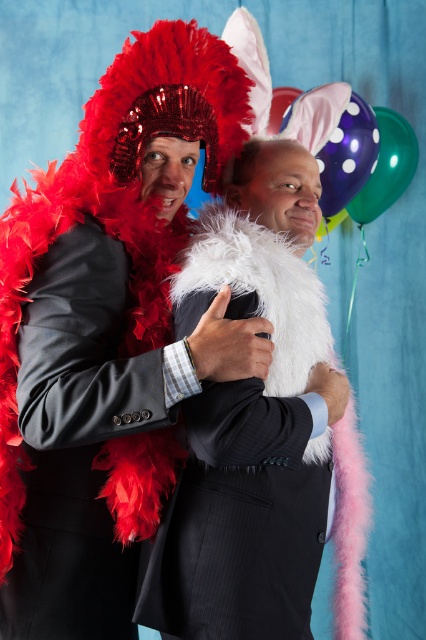
Based on the photo, which is more to the left, white fluffy boa at center or shiny purple balloon at upper right?

Positioned to the left is white fluffy boa at center.

Does white fluffy boa at center come behind shiny purple balloon at upper right?

No, white fluffy boa at center is closer to the viewer.

This screenshot has width=426, height=640. In order to click on white fluffy boa at center in this screenshot , I will do `click(241, 522)`.

The height and width of the screenshot is (640, 426). Find the location of `white fluffy boa at center`. white fluffy boa at center is located at coordinates (241, 522).

Who is lower down, white fluffy boa at center or purple dotted balloon at upper center?

white fluffy boa at center is lower down.

Does point (244, 456) come in front of point (325, 161)?

Yes, point (244, 456) is closer to viewer.

Locate an element on the screen. The height and width of the screenshot is (640, 426). white fluffy boa at center is located at coordinates (241, 522).

Can you confirm if purple dotted balloon at upper center is shorter than shiny purple balloon at upper right?

No.

Does purple dotted balloon at upper center have a smaller size compared to shiny purple balloon at upper right?

Incorrect, purple dotted balloon at upper center is not smaller in size than shiny purple balloon at upper right.

Which is behind, point (342, 131) or point (400, 182)?

The point (400, 182) is more distant.

Find the location of a particular element. Image resolution: width=426 pixels, height=640 pixels. purple dotted balloon at upper center is located at coordinates (347, 156).